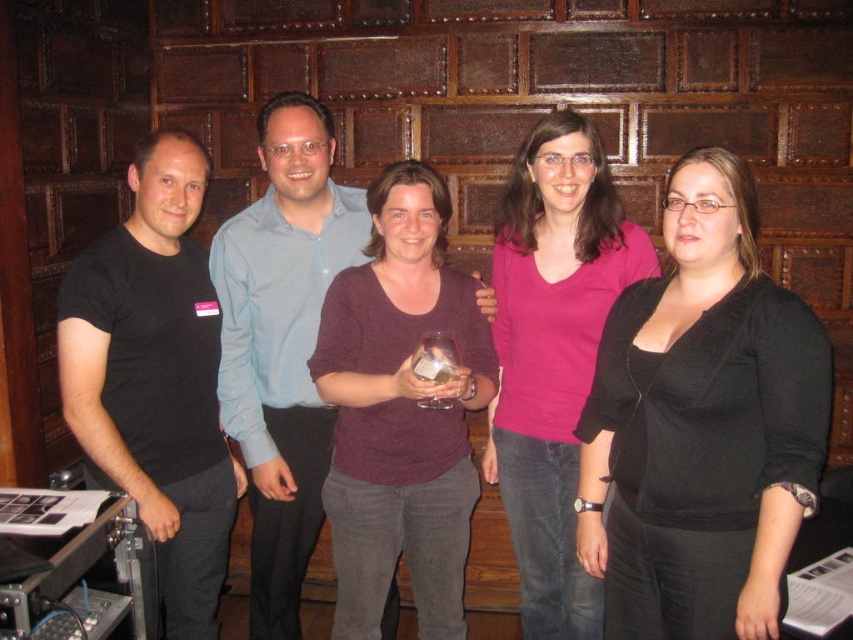
Does maroon sweater at center have a lesser height compared to black matte t-shirt at left?

Yes.

Can you confirm if maroon sweater at center is positioned below black matte t-shirt at left?

No.

Which is behind, point (438, 385) or point (186, 140)?

Positioned behind is point (186, 140).

Where is `maroon sweater at center`? This screenshot has height=640, width=853. maroon sweater at center is located at coordinates (399, 412).

Between black matte t-shirt at left and pink matte shirt at center, which one has less height?

Standing shorter between the two is black matte t-shirt at left.

Between black matte t-shirt at left and pink matte shirt at center, which one has more height?

pink matte shirt at center is taller.

You are a GUI agent. You are given a task and a screenshot of the screen. Output one action in this format:
    pyautogui.click(x=<x>, y=<y>)
    Task: Click on the black matte t-shirt at left
    This screenshot has width=853, height=640.
    Given the screenshot: What is the action you would take?
    pyautogui.click(x=155, y=380)

This screenshot has width=853, height=640. Find the location of `black matte t-shirt at left`. black matte t-shirt at left is located at coordinates (155, 380).

Is black matte t-shirt at left to the right of transparent glass at center from the viewer's perspective?

In fact, black matte t-shirt at left is to the left of transparent glass at center.

Between black matte t-shirt at left and transparent glass at center, which one is positioned higher?

transparent glass at center is above.

Where is `black matte t-shirt at left`? black matte t-shirt at left is located at coordinates 155,380.

Locate an element on the screen. black matte t-shirt at left is located at coordinates (155, 380).